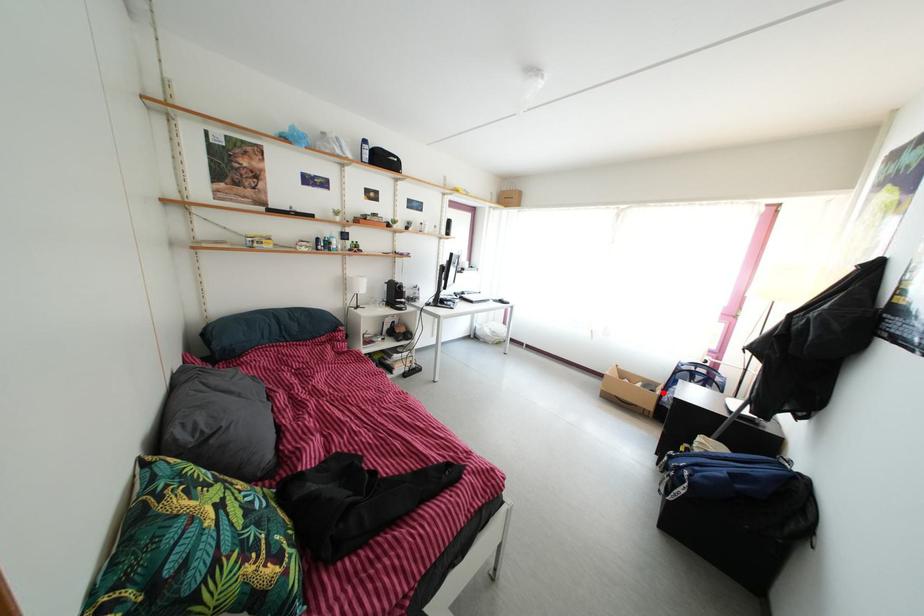
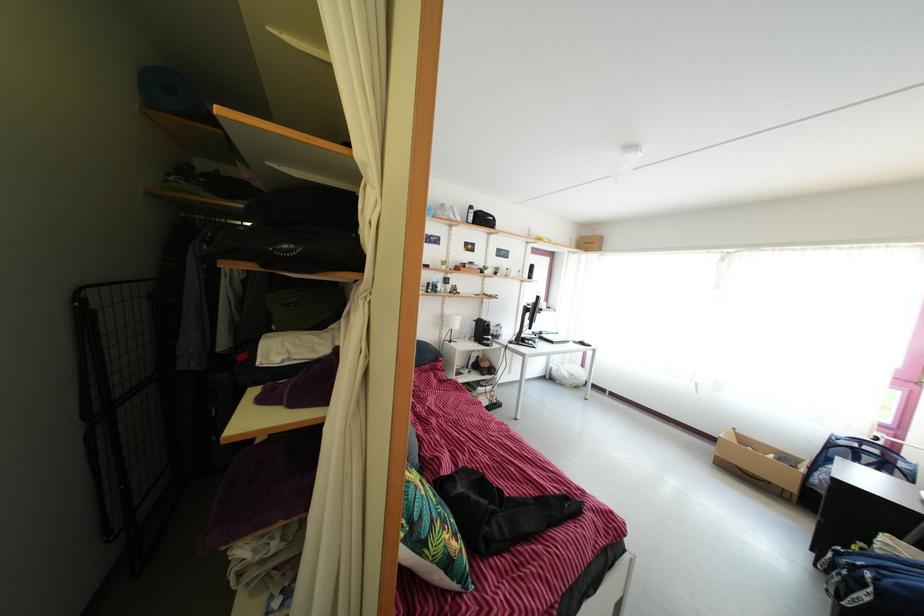
The point at the highlighted location is marked in the first image. Where is the corresponding point in the second image?

(805, 468)